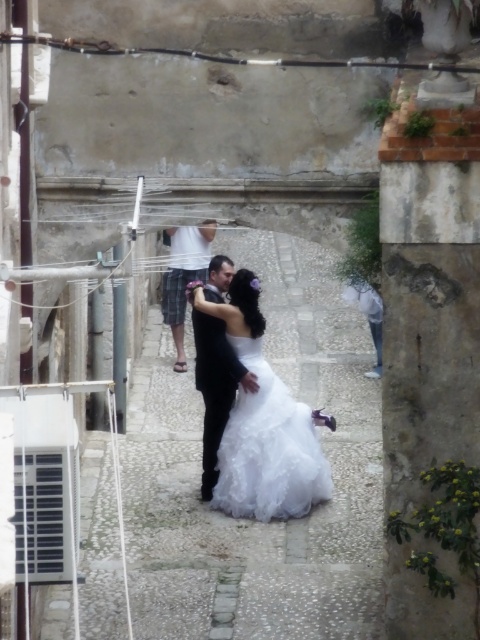
Which is behind, point (214, 288) or point (179, 310)?

Point (179, 310)

What do you see at coordinates (216, 387) in the screenshot? The height and width of the screenshot is (640, 480). I see `black satin suit at center` at bounding box center [216, 387].

Who is more forward, (195, 384) or (175, 344)?

Positioned in front is point (195, 384).

The height and width of the screenshot is (640, 480). I want to click on black satin suit at center, so click(x=216, y=387).

Does white satin dress at center come behind white lace dress at center?

Yes, it is behind white lace dress at center.

Is point (263, 330) farther from camera compared to point (233, 476)?

Yes, point (263, 330) is farther from viewer.

This screenshot has width=480, height=640. In order to click on white satin dress at center in this screenshot , I will do `click(263, 422)`.

Can you confirm if white satin dress at center is positioned above black satin suit at center?

Actually, white satin dress at center is below black satin suit at center.

Which is in front, point (297, 474) or point (207, 465)?

Point (297, 474) is in front.

The width and height of the screenshot is (480, 640). What do you see at coordinates (263, 422) in the screenshot? I see `white satin dress at center` at bounding box center [263, 422].

Image resolution: width=480 pixels, height=640 pixels. Find the location of `white satin dress at center`. white satin dress at center is located at coordinates (263, 422).